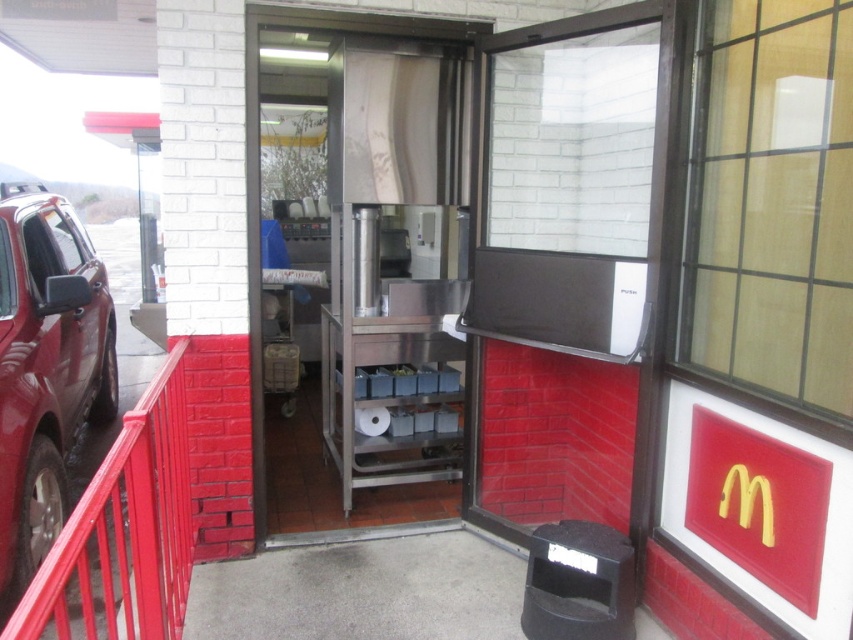
Measure the distance between clear glass door at center and camera.

6.08 feet

Who is shorter, clear glass door at center or red metal railing at left?

red metal railing at left

Between point (735, 147) and point (109, 484), which one is positioned behind?

The point (735, 147) is behind.

This screenshot has width=853, height=640. I want to click on clear glass door at center, so click(x=770, y=200).

Describe the element at coordinates (45, 369) in the screenshot. I see `shiny dark red suv at left` at that location.

Which is more to the right, shiny dark red suv at left or red metal railing at left?

red metal railing at left is more to the right.

At what (x,y) coordinates should I click in order to perform the action: click on shiny dark red suv at left. Please return your answer as a coordinate pair (x, y). The height and width of the screenshot is (640, 853). Looking at the image, I should click on (45, 369).

Can you confirm if clear glass door at center is wider than shiny dark red suv at left?

No, clear glass door at center is not wider than shiny dark red suv at left.

Between point (734, 90) and point (100, 285), which one is positioned behind?

Positioned behind is point (100, 285).

Is point (756, 300) positioned behind point (3, 314)?

No, it is not.

Locate an element on the screen. This screenshot has width=853, height=640. clear glass door at center is located at coordinates (770, 200).